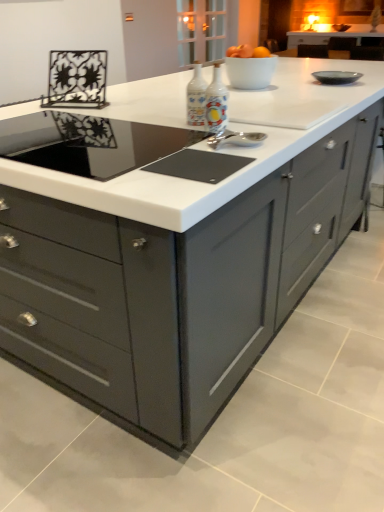
Locate an element on the screen. The width and height of the screenshot is (384, 512). free region on the left part of matte glass bottles at center, positioned as the first appliance in left-to-right order is located at coordinates (163, 120).